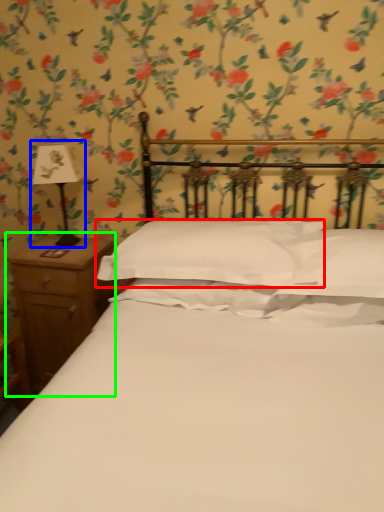
Question: Estimate the real-world distances between objects in this image. Which object is farther from pillow (highlighted by a red box), bedside lamp (highlighted by a blue box) or nightstand (highlighted by a green box)?

Choices:
 (A) bedside lamp
 (B) nightstand

Answer: (A)